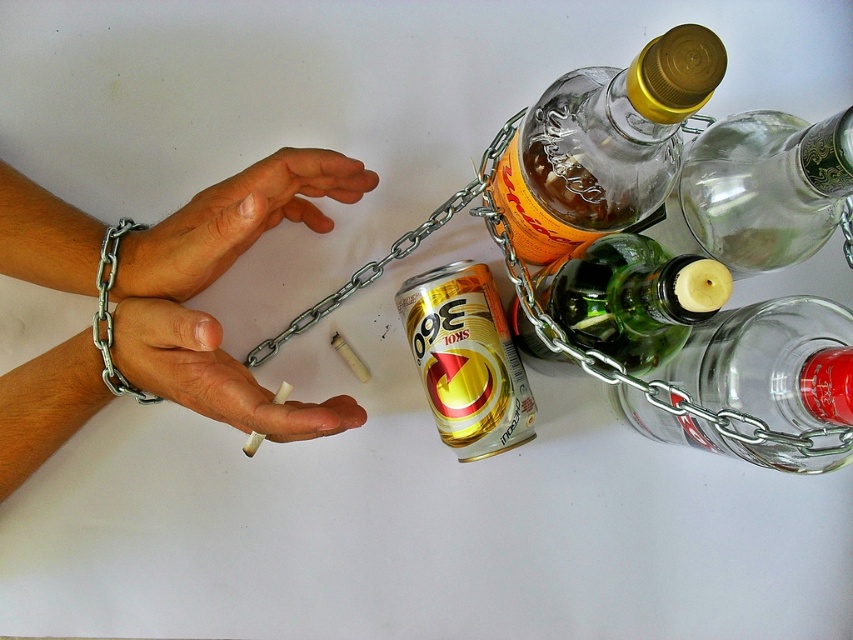
Based on the scene description, where is the metal chain at left in relation to the translucent glass bottle at upper right?

The metal chain at left is located below the translucent glass bottle at upper right.

You are an observer looking at the image. Can you tell me the position of the gold metallic can at center relative to the white matte cigarette at center?

The gold metallic can at center is to the right of the white matte cigarette at center.